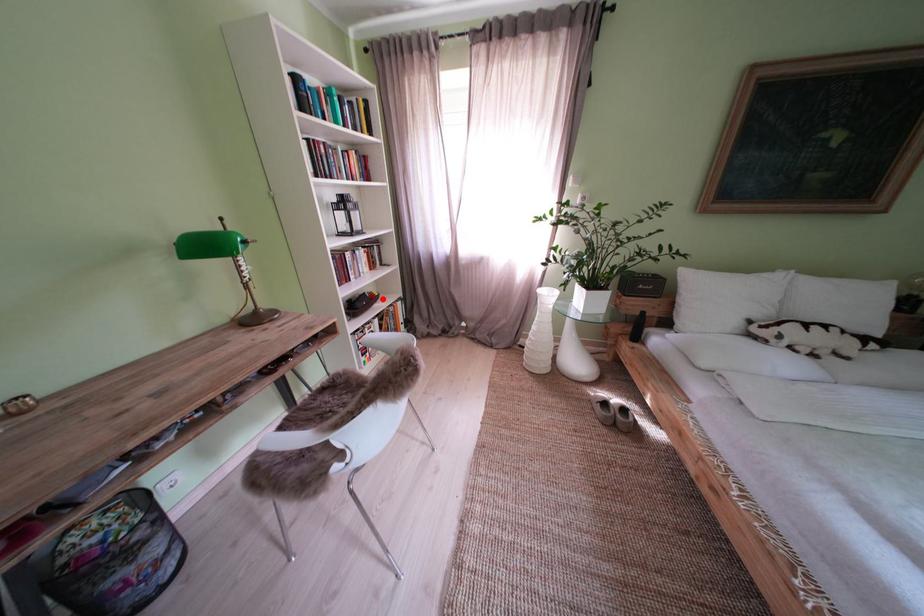
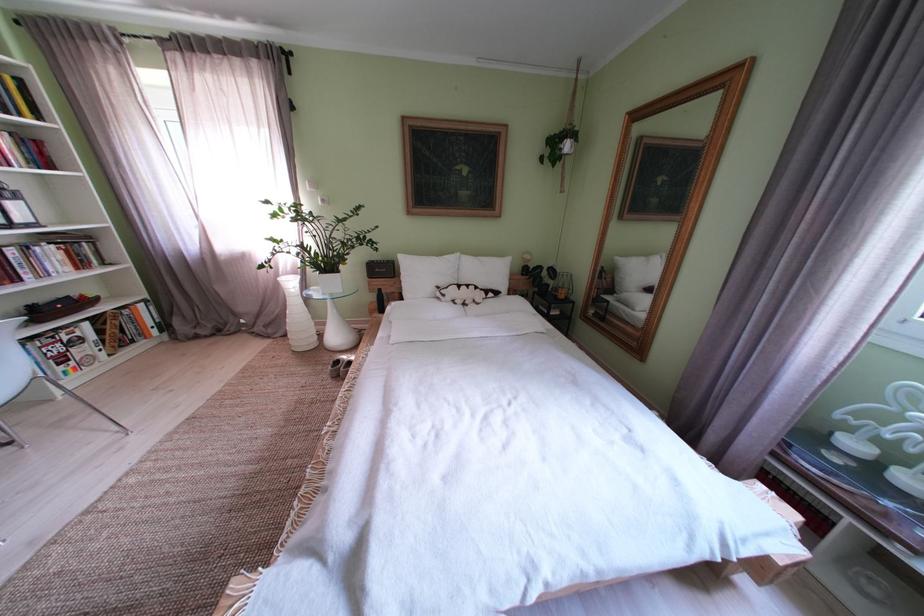
Find the pixel in the second image that matches the highlighted location in the first image.

(92, 302)